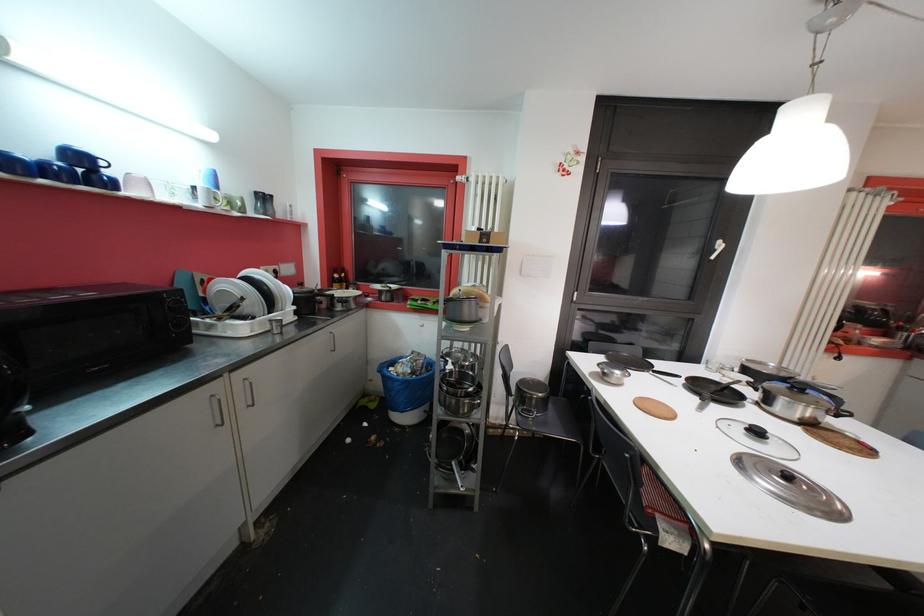
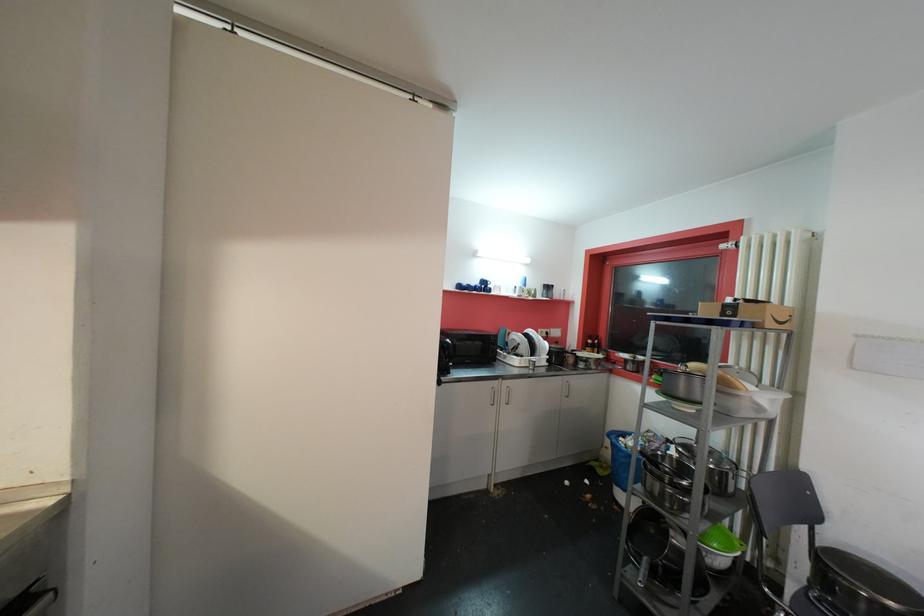
Find the pixel in the second image that matches point 248,203 in the first image.

(541, 293)